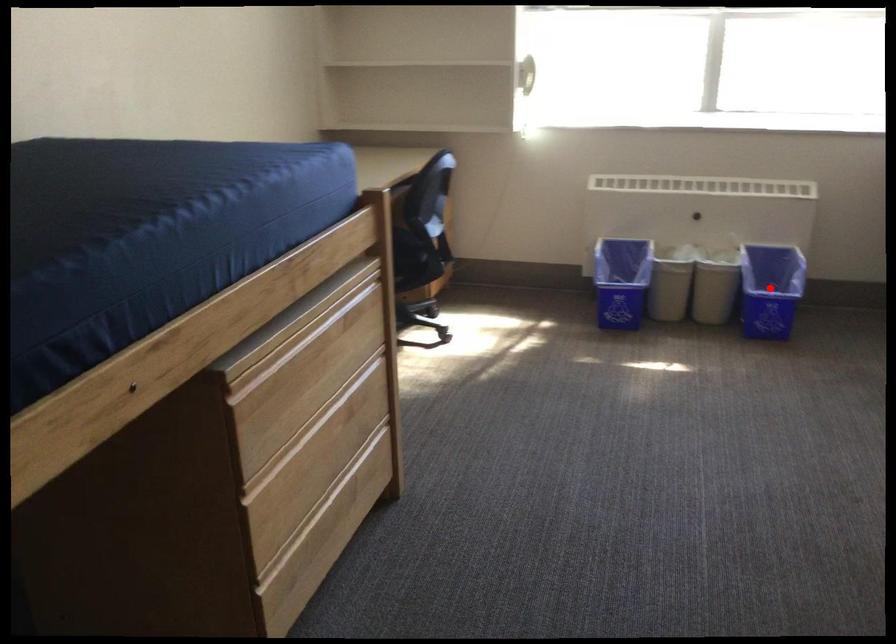
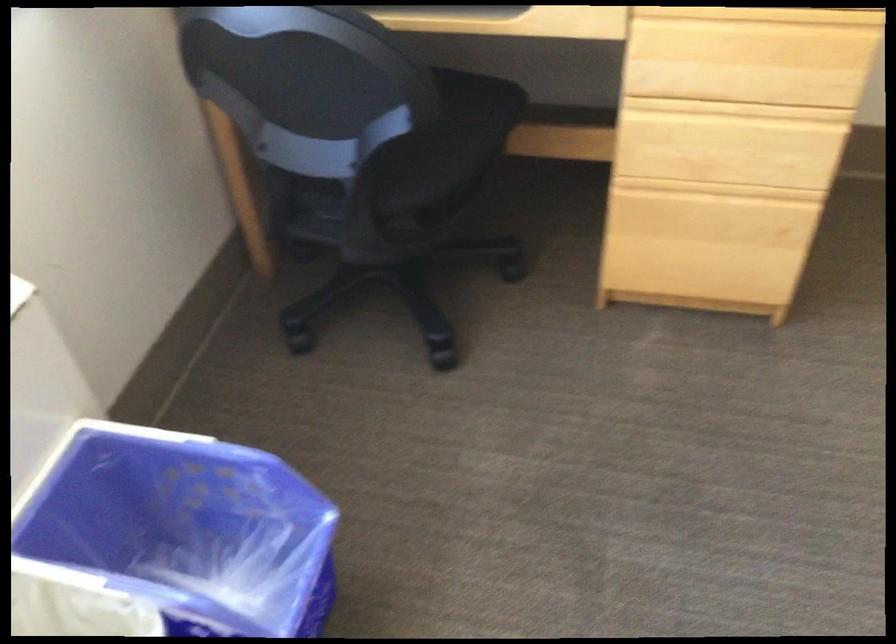
Question: I am providing you with two images of the same scene from different viewpoints. In image1, a red point is highlighted. Considering the same 3D point in image2, which of the following is correct?

Choices:
 (A) It is closer
 (B) It is farther

Answer: (A)